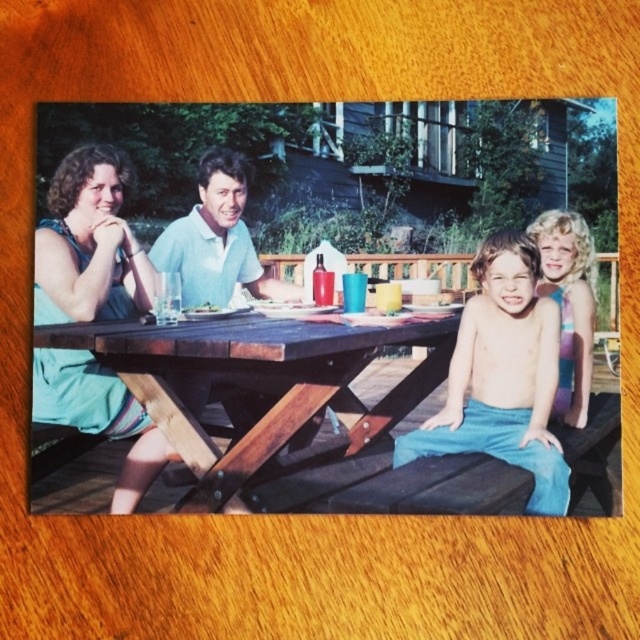
Question: In this image, where is wooden picnic table at center located relative to blonde hair at right?

Choices:
 (A) right
 (B) left

Answer: (B)

Question: Observing the image, what is the correct spatial positioning of brown wooden table at center in reference to teal fabric dress at left?

Choices:
 (A) above
 (B) below

Answer: (B)

Question: Which of the following is the farthest from the observer?

Choices:
 (A) teal fabric dress at left
 (B) blue denim pants at center
 (C) brown wooden table at center
 (D) wooden picnic table at center

Answer: (C)

Question: Which of the following is the closest to the observer?

Choices:
 (A) teal fabric dress at left
 (B) blonde hair at right

Answer: (A)

Question: Which object appears farthest from the camera in this image?

Choices:
 (A) brown wooden table at center
 (B) blonde hair at right
 (C) blue denim pants at center

Answer: (B)

Question: Is brown wooden table at center wider than blue denim pants at center?

Choices:
 (A) yes
 (B) no

Answer: (A)